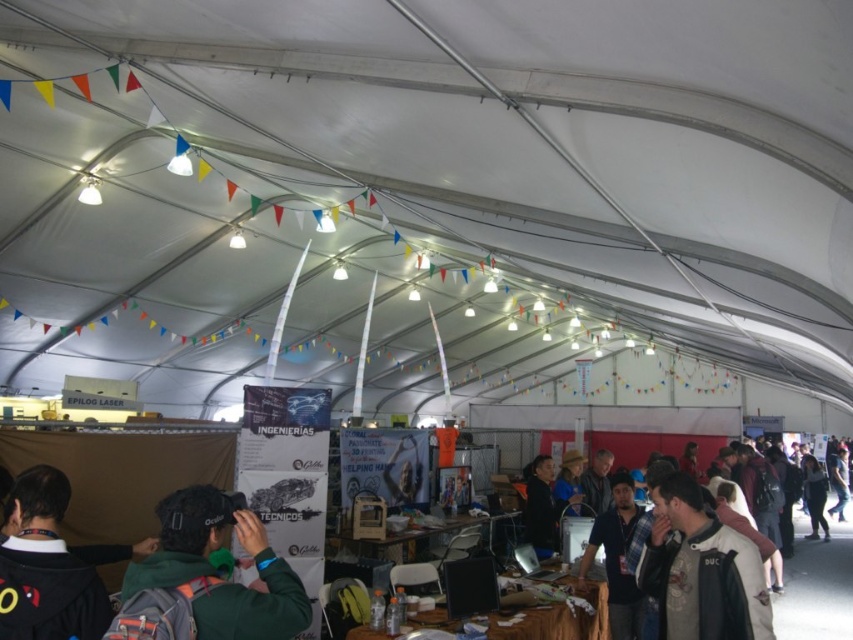
Question: Does dark brown leather jacket at lower right have a greater width compared to dark gray jacket at center?

Choices:
 (A) no
 (B) yes

Answer: (A)

Question: Does dark blue jacket at lower right have a lesser width compared to wooden table at center?

Choices:
 (A) no
 (B) yes

Answer: (A)

Question: Among these points, which one is farthest from the camera?

Choices:
 (A) (680, 608)
 (B) (74, 595)
 (C) (583, 586)

Answer: (C)

Question: Based on their relative distances, which object is farther from the dark blue shirt at center?

Choices:
 (A) dark green hoodie at lower left
 (B) dark brown leather jacket at lower right
 (C) dark blue jacket at lower right
 (D) green fleece jacket at center

Answer: (C)

Question: Estimate the real-world distances between objects in this image. Which object is farther from the dark blue shirt at center?

Choices:
 (A) dark gray jacket at center
 (B) green fleece jacket at center

Answer: (B)

Question: Is dark blue jacket at lower right below wooden table at center?

Choices:
 (A) yes
 (B) no

Answer: (A)